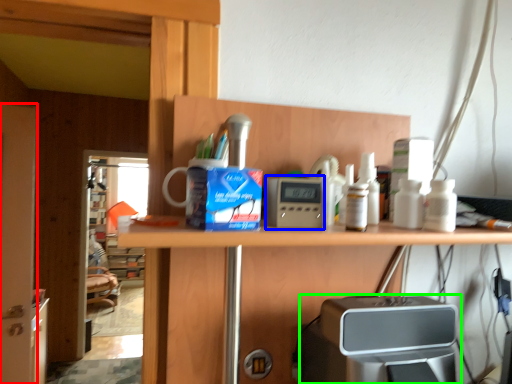
Question: Which object is the closest to the screen door (highlighted by a red box)? Choose among these: appliance (highlighted by a blue box) or home appliance (highlighted by a green box).

Choices:
 (A) appliance
 (B) home appliance

Answer: (B)